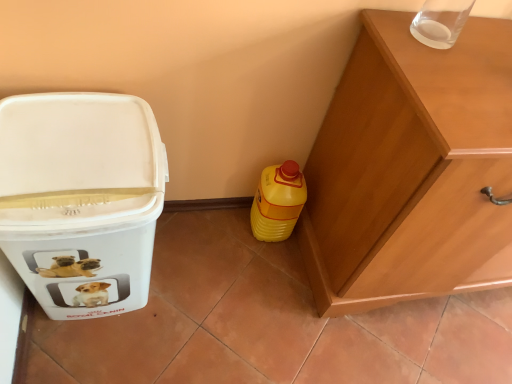
The image size is (512, 384). Find the location of `wooden cabinet at right`. wooden cabinet at right is located at coordinates (411, 169).

Measure the distance between yellow plastic bottle at lower right and camera.

yellow plastic bottle at lower right and camera are 4.16 feet apart from each other.

I want to click on white plastic container at left, so click(81, 198).

The image size is (512, 384). I want to click on wooden cabinet at right, so click(x=411, y=169).

Consider the image. Does yellow plastic bottle at lower right turn towards white plastic container at left?

No, yellow plastic bottle at lower right is not turned towards white plastic container at left.

From the image's perspective, would you say yellow plastic bottle at lower right is shown under white plastic container at left?

No.

Which is farther from the camera, (298, 215) or (72, 295)?

The point (298, 215) is behind.

In terms of size, does yellow plastic bottle at lower right appear bigger or smaller than white plastic container at left?

In the image, yellow plastic bottle at lower right appears to be smaller than white plastic container at left.

Is wooden cabinet at right further to camera compared to white plastic container at left?

Yes, the depth of wooden cabinet at right is greater than that of white plastic container at left.

Looking at their sizes, would you say wooden cabinet at right is wider or thinner than white plastic container at left?

In the image, wooden cabinet at right appears to be wider than white plastic container at left.

Are wooden cabinet at right and white plastic container at left far apart?

No, wooden cabinet at right is in close proximity to white plastic container at left.

Is point (359, 267) positioned after point (90, 112)?

Yes, point (359, 267) is behind point (90, 112).

Can you confirm if white plastic container at left is positioned to the right of yellow plastic bottle at lower right?

Incorrect, white plastic container at left is not on the right side of yellow plastic bottle at lower right.

There is a yellow plastic bottle at lower right. At what (x,y) coordinates should I click in order to perform the action: click on waste container above it (from a real-world perspective). Please return your answer as a coordinate pair (x, y). The width and height of the screenshot is (512, 384). Looking at the image, I should click on (81, 198).

Could you tell me if white plastic container at left is facing yellow plastic bottle at lower right?

No, white plastic container at left is not oriented towards yellow plastic bottle at lower right.

Does point (21, 185) appear closer or farther from the camera than point (260, 224)?

Point (21, 185) appears to be closer to the viewer than point (260, 224).

Considering the sizes of yellow plastic bottle at lower right and wooden cabinet at right in the image, is yellow plastic bottle at lower right taller or shorter than wooden cabinet at right?

yellow plastic bottle at lower right is shorter than wooden cabinet at right.

Considering the sizes of objects yellow plastic bottle at lower right and wooden cabinet at right in the image provided, who is smaller, yellow plastic bottle at lower right or wooden cabinet at right?

Smaller between the two is yellow plastic bottle at lower right.

In the scene shown: Is yellow plastic bottle at lower right wider than wooden cabinet at right?

In fact, yellow plastic bottle at lower right might be narrower than wooden cabinet at right.

Is yellow plastic bottle at lower right placed right next to wooden cabinet at right?

There is a gap between yellow plastic bottle at lower right and wooden cabinet at right.

Can you confirm if white plastic container at left is shorter than wooden cabinet at right?

Indeed, white plastic container at left has a lesser height compared to wooden cabinet at right.

Does point (135, 207) come behind point (447, 273)?

No.

Can you tell me how much white plastic container at left and wooden cabinet at right differ in facing direction?

The facing directions of white plastic container at left and wooden cabinet at right are 0.553 degrees apart.

Is there a large distance between white plastic container at left and wooden cabinet at right?

They are positioned close to each other.

Considering the sizes of objects wooden cabinet at right and yellow plastic bottle at lower right in the image provided, who is thinner, wooden cabinet at right or yellow plastic bottle at lower right?

With smaller width is yellow plastic bottle at lower right.

Considering the positions of points (443, 188) and (293, 176), is point (443, 188) farther from camera compared to point (293, 176)?

No, (443, 188) is in front of (293, 176).

Is wooden cabinet at right aimed at yellow plastic bottle at lower right?

No, wooden cabinet at right is not oriented towards yellow plastic bottle at lower right.

At what (x,y) coordinates should I click in order to perform the action: click on bottle that is behind the white plastic container at left. Please return your answer as a coordinate pair (x, y). Looking at the image, I should click on (278, 202).

This screenshot has height=384, width=512. I want to click on cabinetry that appears above the white plastic container at left (from a real-world perspective), so click(x=411, y=169).

From the image, which object appears to be farther from white plastic container at left, yellow plastic bottle at lower right or wooden cabinet at right?

wooden cabinet at right is further to white plastic container at left.

Estimate the real-world distances between objects in this image. Which object is further from wooden cabinet at right, yellow plastic bottle at lower right or white plastic container at left?

Based on the image, white plastic container at left appears to be further to wooden cabinet at right.

Estimate the real-world distances between objects in this image. Which object is further from wooden cabinet at right, white plastic container at left or yellow plastic bottle at lower right?

white plastic container at left lies further to wooden cabinet at right than the other object.

Based on their spatial positions, is white plastic container at left or wooden cabinet at right closer to yellow plastic bottle at lower right?

wooden cabinet at right is closer to yellow plastic bottle at lower right.

Based on the photo, based on their spatial positions, is wooden cabinet at right or yellow plastic bottle at lower right further from white plastic container at left?

wooden cabinet at right is further to white plastic container at left.

From the image, which object appears to be nearer to yellow plastic bottle at lower right, wooden cabinet at right or white plastic container at left?

The object closer to yellow plastic bottle at lower right is wooden cabinet at right.

Identify the location of bottle between white plastic container at left and wooden cabinet at right in the horizontal direction. (278, 202).